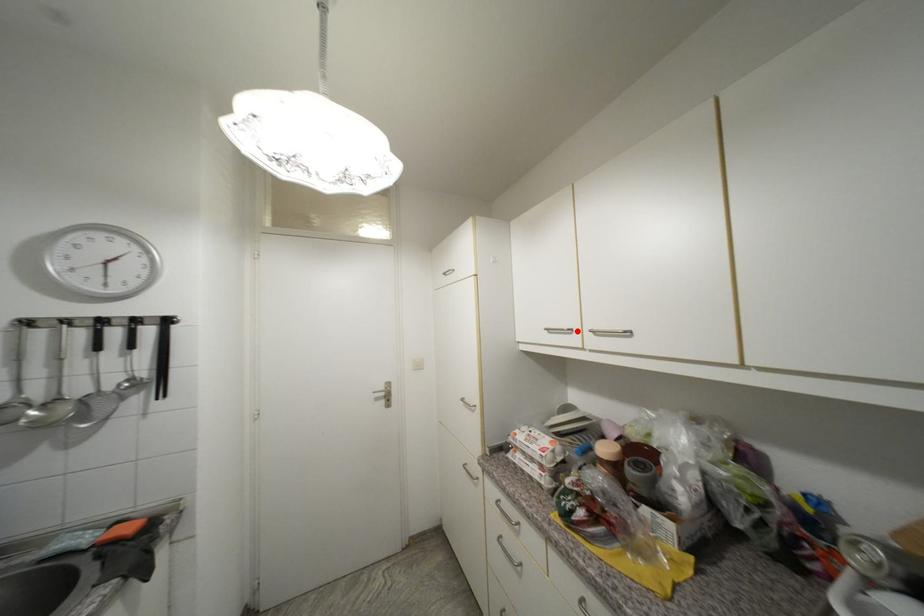
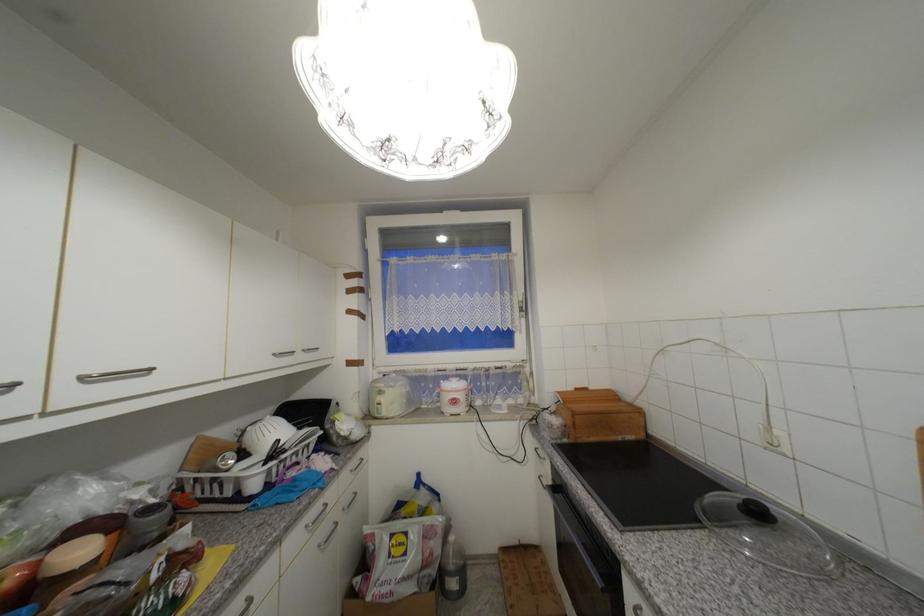
Question: I am providing you with two images of the same scene from different viewpoints. A red point is marked on the first image. Is the red point's position out of view in image 2?

Choices:
 (A) Yes
 (B) No

Answer: (B)